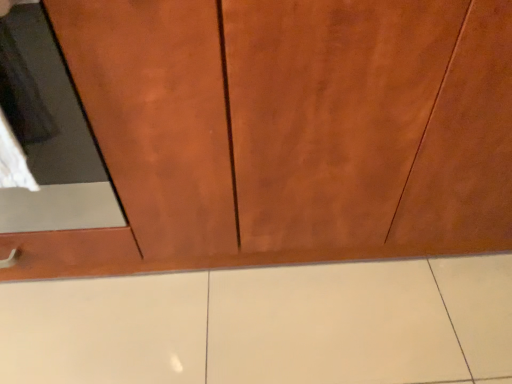
At what (x,y) coordinates should I click in order to perform the action: click on matte wood cupboard at center. Please return your answer as a coordinate pair (x, y). The image size is (512, 384). Looking at the image, I should click on (288, 132).

What do you see at coordinates (288, 132) in the screenshot?
I see `matte wood cupboard at center` at bounding box center [288, 132].

I want to click on matte wood cupboard at center, so click(288, 132).